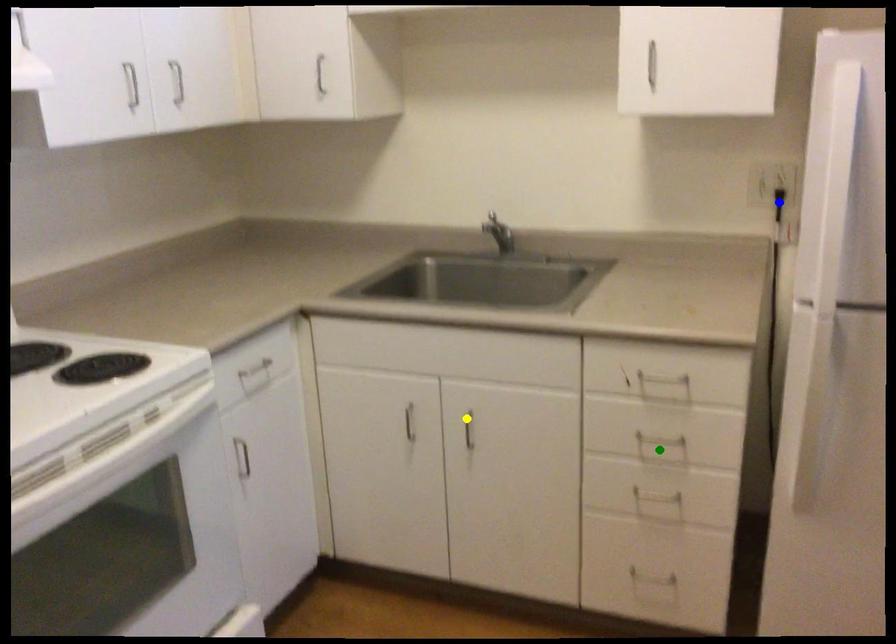
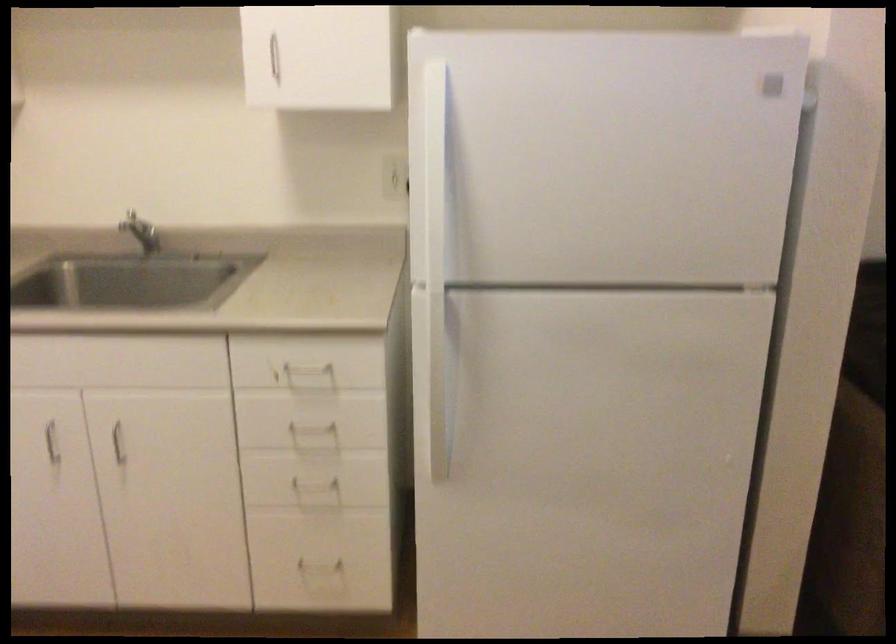
I am providing you with two images of the same scene from different viewpoints. Three points are marked in image1. Which point corresponds to a part or object that is occluded in image2?In image1, three points are marked. Which of them correspond to a part or object that is occluded in image2?Among the three points shown in image1, which one corresponds to a part or object that is no longer visible due to occlusion in image2?

blue point cannot be seen in image2.